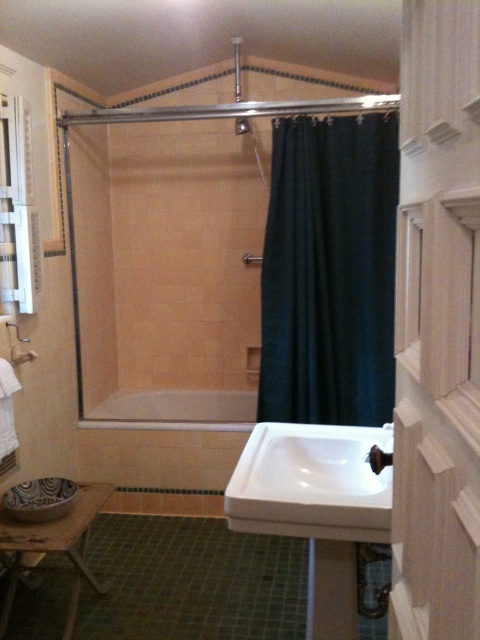
You are standing in the bathroom and want to turn on the water. Which object should you interact with first, the white wood screen door at center or the white ceramic faucet at lower center?

You should interact with the white ceramic faucet at lower center first because it is further away from you than the white wood screen door at center, so you need to reach past the door to access it.

You are a delivery person holding a box that is 20 inches wide. You need to pass through the space between the white wood screen door at center and the shower curtain rod. Will your box fit through the space?

The space between the white wood screen door at center and the shower curtain rod is 21.65 inches. Since the box is 20 inches wide, it will fit through the space as it is narrower than the available gap.